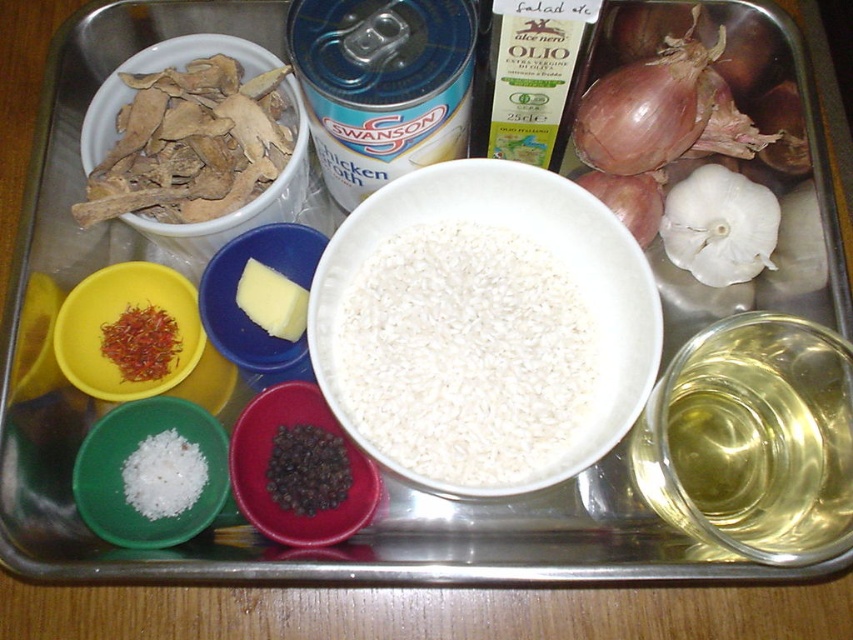
You are holding a 12 inch long spatula and want to reach the point at coordinates point (x=306, y=273). Can your spatula reach that point?

The distance between point (x=306, y=273) and the camera is 35.79 inches. Since the spatula is only 12 inches long, it cannot reach the point at point (x=306, y=273).

What is located at the point with coordinates (236, 285) on the metal tray?

The point at coordinates (236, 285) on the metal tray corresponds to the yellow matte butter at center.

You are a chef preparing a dish and need to reach both the dark red plastic bowl at center and the white matte rice at center. Which one would you grab first if you are standing directly in front of the tray?

You would grab the dark red plastic bowl at center first because it is closer to you than the white matte rice at center.